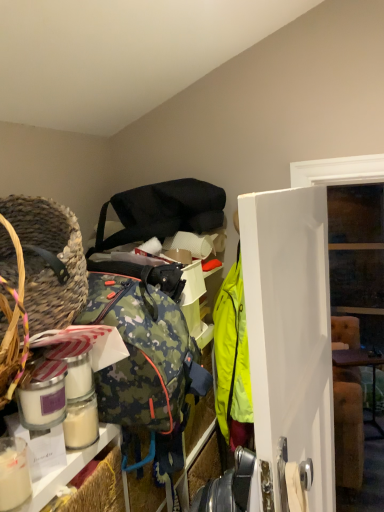
Question: From the image's perspective, relative to white glossy door at center, is braided straw basket at left above or below?

Choices:
 (A) above
 (B) below

Answer: (A)

Question: From a real-world perspective, is braided straw basket at left physically located above or below white glossy door at center?

Choices:
 (A) above
 (B) below

Answer: (A)

Question: Estimate the real-world distances between objects in this image. Which object is closer to the brown wooden table at right?

Choices:
 (A) matte black shoulder bag at upper center
 (B) white glossy door at center
 (C) braided straw basket at left

Answer: (B)

Question: Which object is positioned farthest from the matte black shoulder bag at upper center?

Choices:
 (A) braided straw basket at left
 (B) brown wooden table at right
 (C) white glossy door at center

Answer: (B)